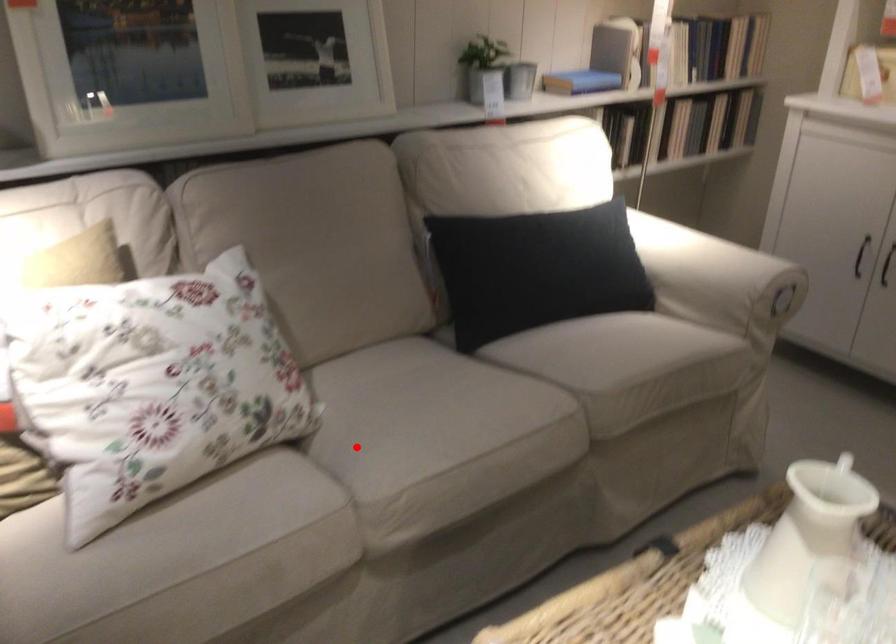
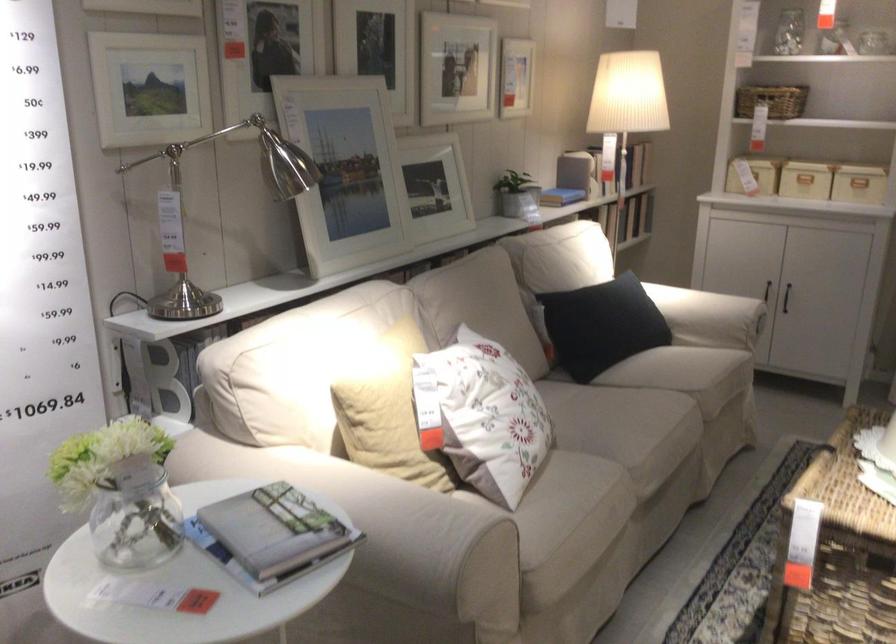
In the second image, find the point that corresponds to the highlighted location in the first image.

(596, 442)